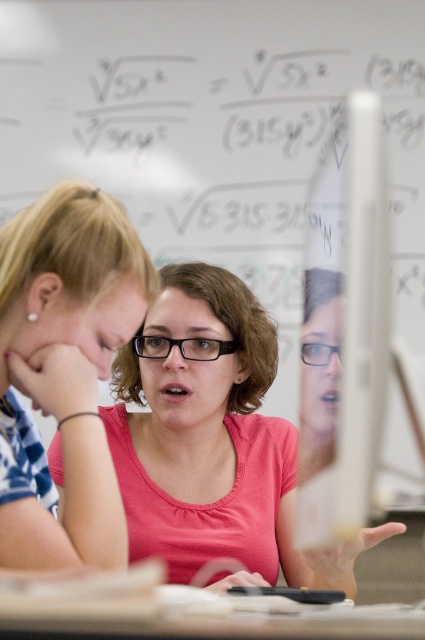
Is pink matte shirt at center shorter than pink matte shirt at upper left?

No.

Who is shorter, pink matte shirt at center or pink matte shirt at upper left?

pink matte shirt at upper left

Looking at this image, who is more distant from viewer, (244, 460) or (136, 310)?

The point (244, 460) is more distant.

Image resolution: width=425 pixels, height=640 pixels. Find the location of `pink matte shirt at center`. pink matte shirt at center is located at coordinates [212, 440].